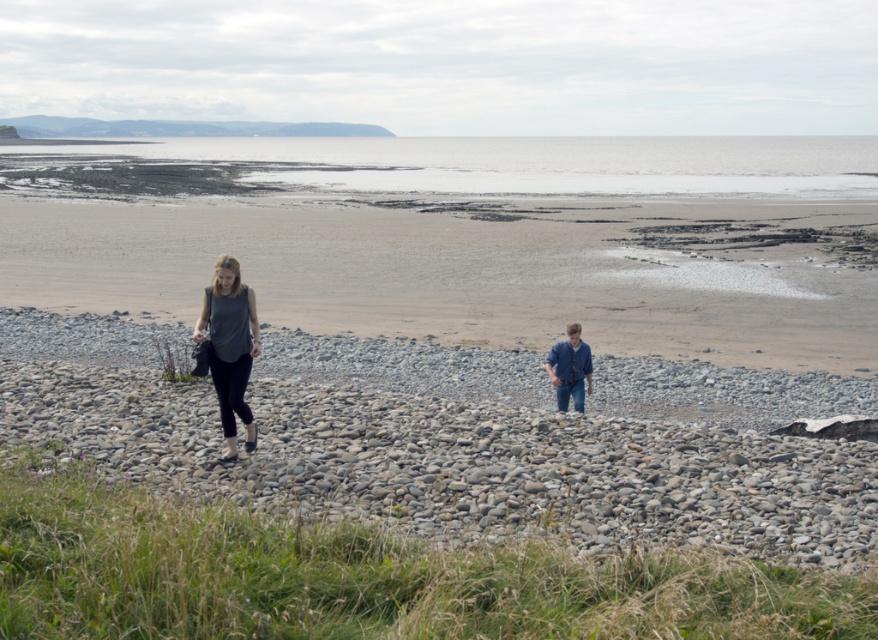
Question: Among these objects, which one is nearest to the camera?

Choices:
 (A) blue denim jeans at lower right
 (B) matte gray top at center

Answer: (B)

Question: Considering the real-world distances, which object is farthest from the gray sand at upper center?

Choices:
 (A) blue denim jeans at lower right
 (B) gray smooth pebbles at center

Answer: (A)

Question: Does gray smooth pebbles at center come in front of matte gray top at center?

Choices:
 (A) no
 (B) yes

Answer: (B)

Question: Which object is positioned farthest from the blue denim jeans at lower right?

Choices:
 (A) gray sand at upper center
 (B) gray smooth pebbles at center
 (C) matte gray top at center

Answer: (A)

Question: Is gray smooth pebbles at center in front of matte gray top at center?

Choices:
 (A) no
 (B) yes

Answer: (B)

Question: Does gray smooth pebbles at center lie in front of matte gray top at center?

Choices:
 (A) no
 (B) yes

Answer: (B)